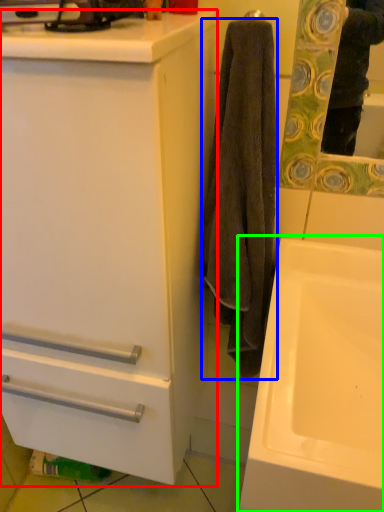
Question: Which object is the closest to the bathroom cabinet (highlighted by a red box)? Choose among these: towel/napkin (highlighted by a blue box) or sink (highlighted by a green box).

Choices:
 (A) towel/napkin
 (B) sink

Answer: (A)